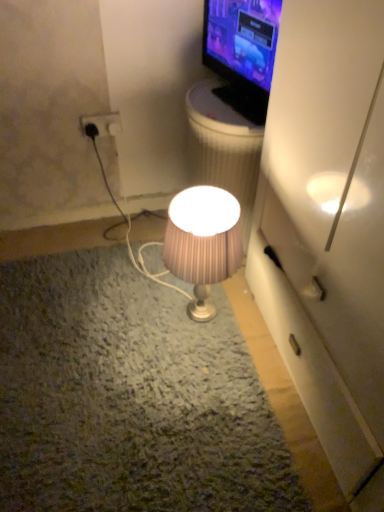
Question: In the image, is matte black tv at upper right on the left side or the right side of white plastic trash bin/can at upper center?

Choices:
 (A) left
 (B) right

Answer: (B)

Question: Based on their sizes in the image, would you say matte black tv at upper right is bigger or smaller than white plastic trash bin/can at upper center?

Choices:
 (A) small
 (B) big

Answer: (A)

Question: Estimate the real-world distances between objects in this image. Which object is closer to the matte black tv at upper right?

Choices:
 (A) pink pleated fabric lampshade at center
 (B) black plastic power outlet at upper left
 (C) white plastic trash bin/can at upper center

Answer: (C)

Question: Which object is positioned closest to the black plastic power outlet at upper left?

Choices:
 (A) pink pleated fabric lampshade at center
 (B) white plastic trash bin/can at upper center
 (C) matte black tv at upper right

Answer: (B)